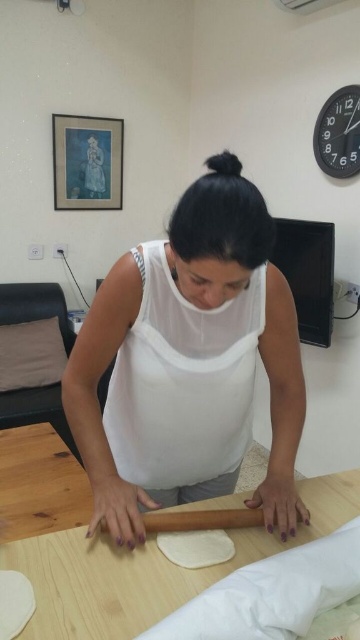
You are a fashion designer observing the scene. You need to determine if the white matte tank top at center and the white dough at center can be distinguished in the image based on their distance apart. What is the minimum distance required for two objects of similar color to be distinguishable in such a setting?

The white matte tank top at center and white dough at center are 30.26 centimeters apart. In typical settings, two similarly colored objects need at least 25 centimeters of separation to be distinguishable, so they can be distinguished as they meet the distance requirement.

You are standing in the living room and see two points marked on the wall. The first point is at coordinates point (141, 579) and the second is at point (176, 516). Which point is closer to you?

Point (141, 579) is in front of point (176, 516), so it is closer to you.